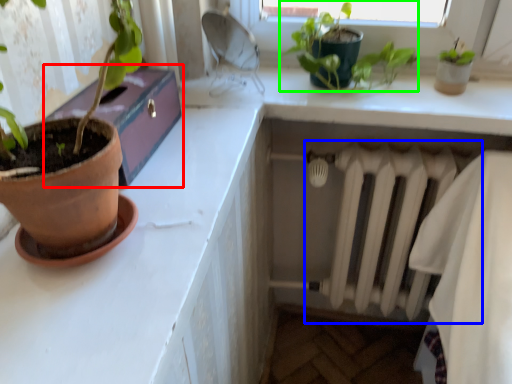
Question: Based on their relative distances, which object is farther from window box (highlighted by a red box)? Choose from radiator (highlighted by a blue box) and houseplant (highlighted by a green box).

Choices:
 (A) radiator
 (B) houseplant

Answer: (A)